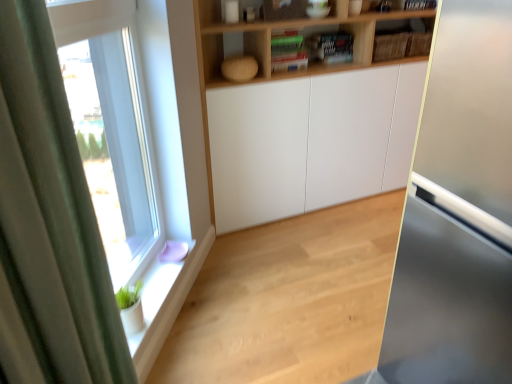
Question: Based on their sizes in the image, would you say green fabric curtain at left is bigger or smaller than natural wood floor at lower left?

Choices:
 (A) big
 (B) small

Answer: (B)

Question: Considering their positions, is green fabric curtain at left located in front of or behind natural wood floor at lower left?

Choices:
 (A) behind
 (B) front

Answer: (B)

Question: Estimate the real-world distances between objects in this image. Which object is closer to the natural wood floor at lower left?

Choices:
 (A) white glossy window sill at lower left
 (B) clear glass window at left
 (C) green fabric curtain at left
 (D) wooden shelf at upper center

Answer: (A)

Question: Which of these objects is positioned closest to the natural wood floor at lower left?

Choices:
 (A) white glossy window sill at lower left
 (B) green fabric curtain at left
 (C) clear glass window at left
 (D) wooden shelf at upper center

Answer: (A)